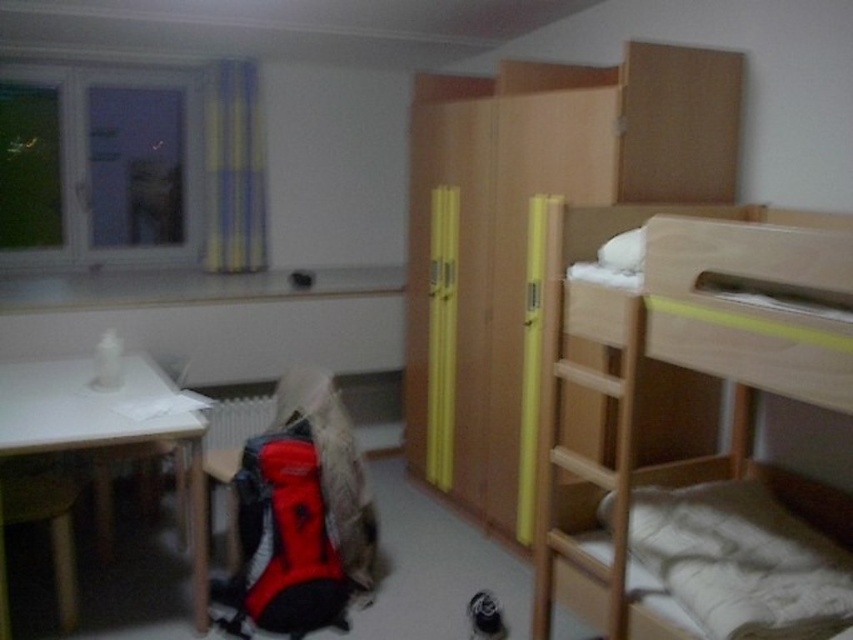
You are standing in the center of the room. There is a point at coordinates (672, 388). What object is located at that point?

The light wood bunk bed at right is located at point (672, 388).

You are trying to hang a picture frame on the wall between the light wood bunk bed at right and the white matte table at left. Which object is closer to the wall where you want to hang the frame?

The light wood bunk bed at right is much taller than the white matte table at left, so the white matte table at left is closer to the wall. You should hang the frame near the white matte table at left.

You are trying to move a rectangular box that is 1 meter wide from the white matte table at left to the light wood bunk bed at right. Based on the scene description, will the box fit on the bunk bed?

The light wood bunk bed at right is thinner than the white matte table at left. Since the box is 1 meter wide, and the bunk bed is thinner than the table, it might not have enough width to accommodate the box. Therefore, the box may not fit on the bunk bed.